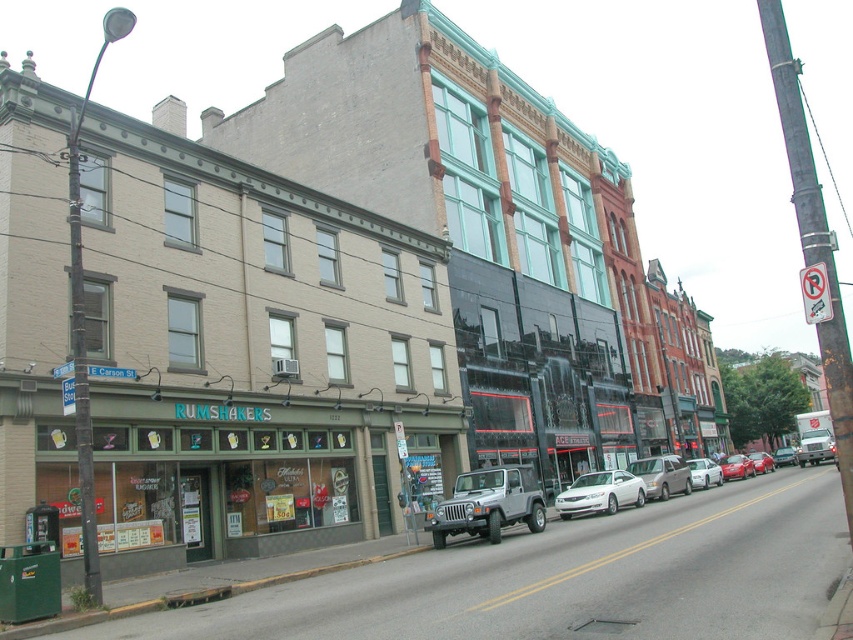
You are a delivery person who needs to park your vehicle between the silver metallic van at center and the metallic red sedan at center. Given that your delivery van is 4 meters long, can you fit your vehicle in the available space between them?

The silver metallic van at center is smaller than the metallic red sedan at center, but the distance between them is not specified. Without knowing the exact space between the two vehicles, it is impossible to determine if your delivery van of 4 meters can fit there.

You are standing at the point marked as point [704,472]. What object is located at this point?

The white matte sedan at center is located at point [704,472].